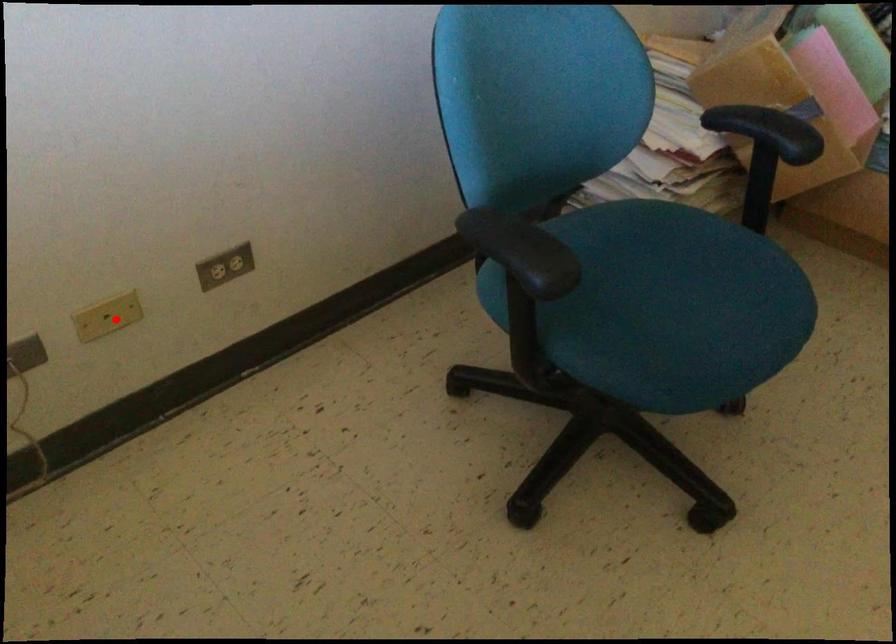
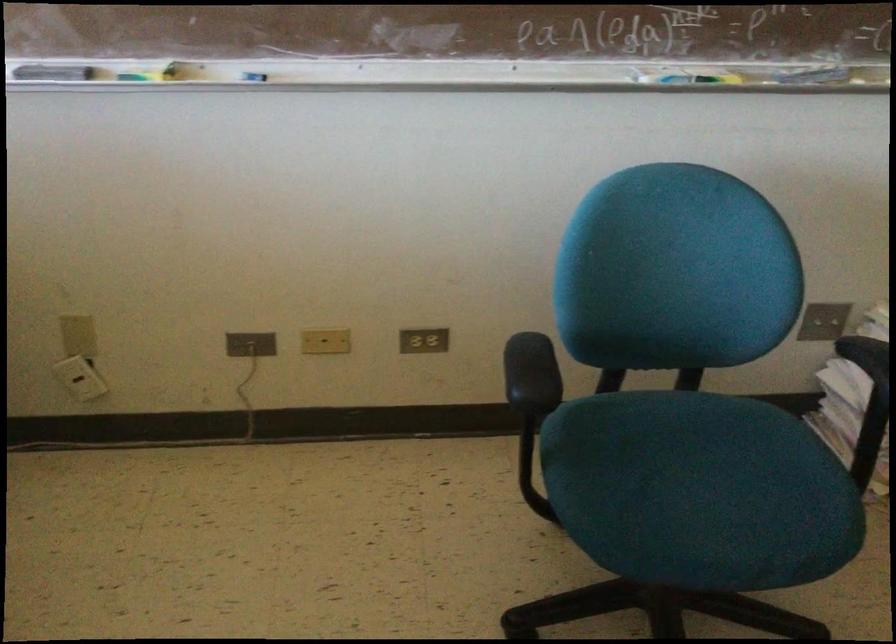
Question: I am providing you with two images of the same scene from different viewpoints. A red point is shown in image1. For the corresponding object point in image2, is it positioned nearer or farther from the camera?

Choices:
 (A) Nearer
 (B) Farther

Answer: (B)